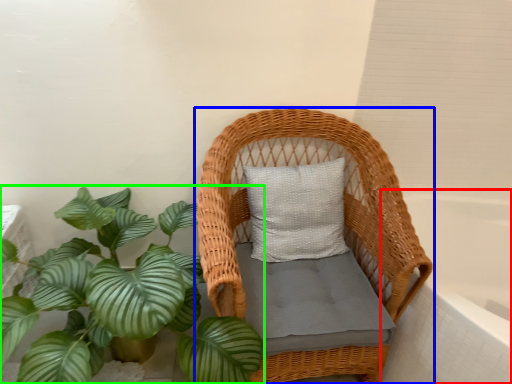
Question: Considering the real-world distances, which object is farthest from bath (highlighted by a red box)? furniture (highlighted by a blue box) or houseplant (highlighted by a green box)?

Choices:
 (A) furniture
 (B) houseplant

Answer: (B)